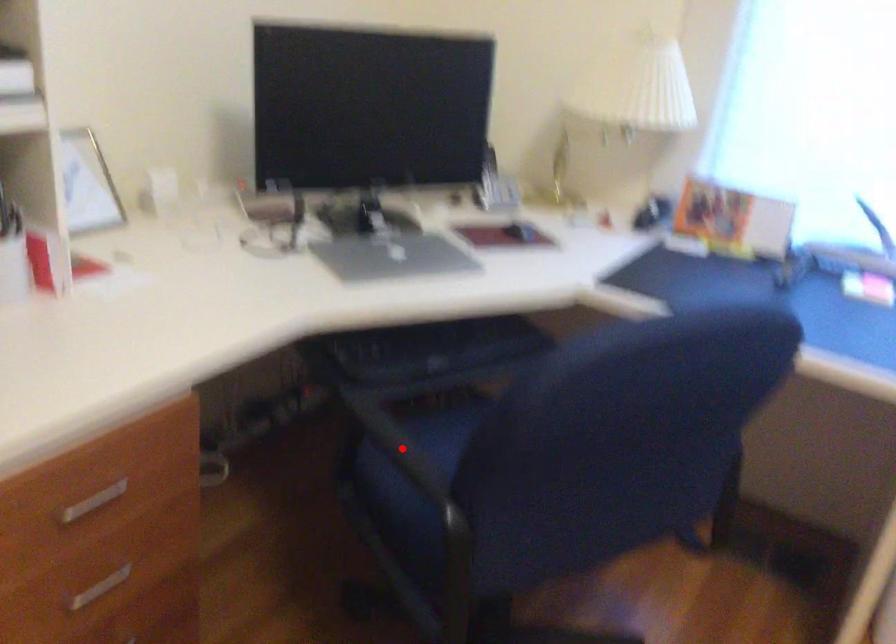
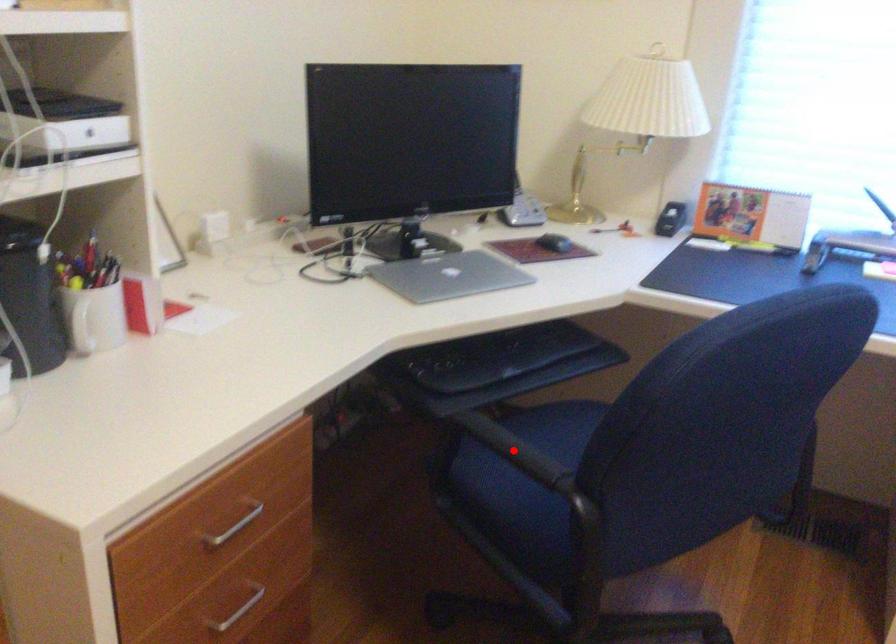
I am providing you with two images of the same scene from different viewpoints. A red point is marked on the first image and another point is marked on the second image. Do the highlighted points in image1 and image2 indicate the same real-world spot?

Yes